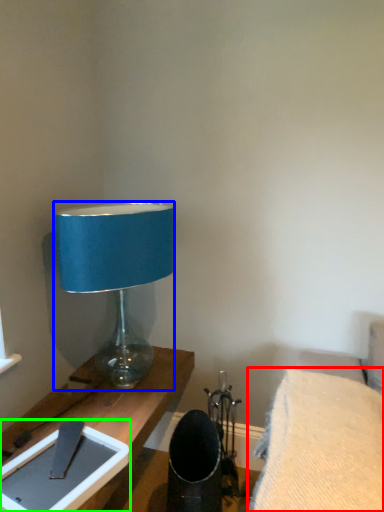
Question: Estimate the real-world distances between objects in this image. Which object is closer to furniture (highlighted by a red box), lamp (highlighted by a blue box) or tablet computer (highlighted by a green box)?

Choices:
 (A) lamp
 (B) tablet computer

Answer: (B)